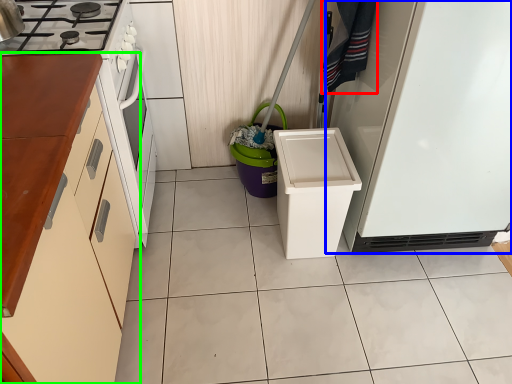
Question: Which object is the closest to the laundry (highlighted by a red box)? Choose among these: refrigerator (highlighted by a blue box) or cabinetry (highlighted by a green box).

Choices:
 (A) refrigerator
 (B) cabinetry

Answer: (A)